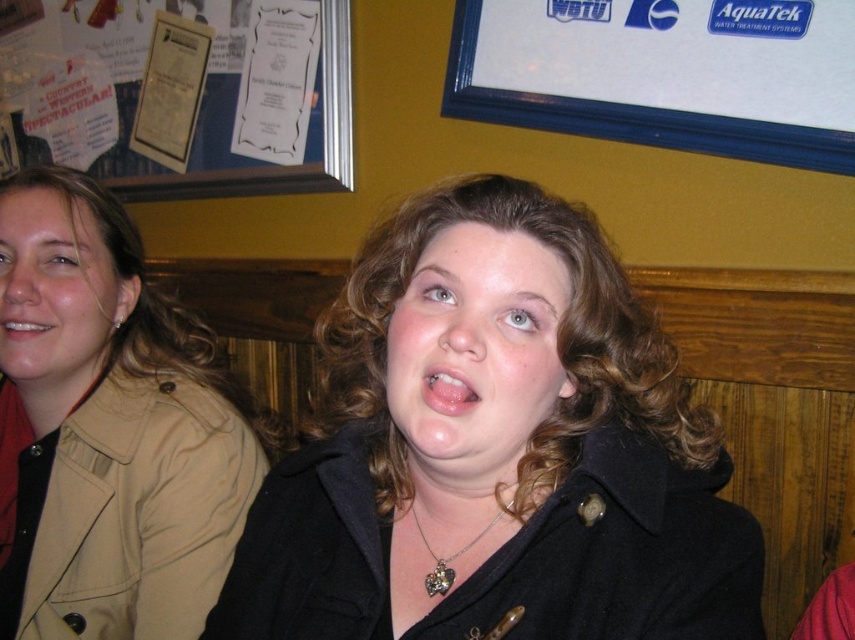
Question: Which point appears closest to the camera in this image?

Choices:
 (A) (458, 406)
 (B) (264, 77)

Answer: (A)

Question: Considering the relative positions of black matte coat at center and paperboard noticeboard at upper left in the image provided, where is black matte coat at center located with respect to paperboard noticeboard at upper left?

Choices:
 (A) below
 (B) above

Answer: (A)

Question: Which point is farther to the camera?

Choices:
 (A) (422, 376)
 (B) (437, 573)
 (C) (227, 116)
 (D) (12, 548)

Answer: (C)

Question: Does pink glossy lips at center have a greater width compared to white glossy teeth at upper left?

Choices:
 (A) yes
 (B) no

Answer: (B)

Question: Is paperboard noticeboard at upper left closer to camera compared to silver metallic heart-shaped pendant at center?

Choices:
 (A) yes
 (B) no

Answer: (B)

Question: Which object is closer to the camera taking this photo?

Choices:
 (A) pink glossy lips at center
 (B) matte beige jacket at left

Answer: (A)